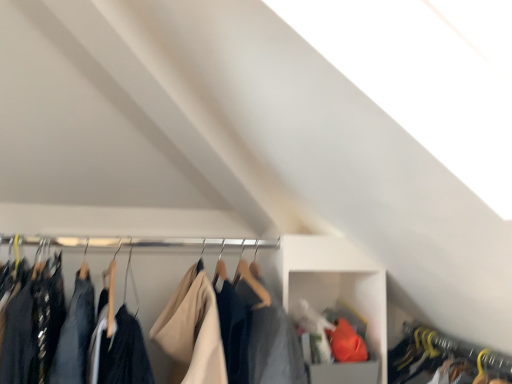
Question: Which direction should I rotate to look at dark blue fabric at center, placed as the first closet when sorted from left to right?

Choices:
 (A) right
 (B) left

Answer: (B)

Question: Can you confirm if yellow hanger at lower right, which is the 2th closet from left to right, is smaller than white plastic cabinet at center?

Choices:
 (A) yes
 (B) no

Answer: (A)

Question: Would you consider yellow hanger at lower right, which is the 2th closet from left to right, to be distant from white plastic cabinet at center?

Choices:
 (A) yes
 (B) no

Answer: (B)

Question: Is yellow hanger at lower right, which is the 2th closet from left to right, facing away from white plastic cabinet at center?

Choices:
 (A) yes
 (B) no

Answer: (B)

Question: Can you confirm if yellow hanger at lower right, which is the 2th closet from left to right, is taller than white plastic cabinet at center?

Choices:
 (A) no
 (B) yes

Answer: (A)

Question: Are yellow hanger at lower right, which is the 2th closet from left to right, and white plastic cabinet at center making contact?

Choices:
 (A) yes
 (B) no

Answer: (B)

Question: Is yellow hanger at lower right, which is the 2th closet from left to right, positioned in front of white plastic cabinet at center?

Choices:
 (A) no
 (B) yes

Answer: (B)

Question: Would you consider white plastic cabinet at center to be distant from dark blue fabric at center, the second closet when ordered from right to left?

Choices:
 (A) no
 (B) yes

Answer: (A)

Question: Can you confirm if white plastic cabinet at center is taller than dark blue fabric at center, the second closet when ordered from right to left?

Choices:
 (A) yes
 (B) no

Answer: (A)

Question: Can we say white plastic cabinet at center lies outside dark blue fabric at center, the second closet when ordered from right to left?

Choices:
 (A) no
 (B) yes

Answer: (B)

Question: Is white plastic cabinet at center at the right side of dark blue fabric at center, placed as the first closet when sorted from left to right?

Choices:
 (A) yes
 (B) no

Answer: (A)

Question: From a real-world perspective, is white plastic cabinet at center over dark blue fabric at center, the second closet when ordered from right to left?

Choices:
 (A) no
 (B) yes

Answer: (A)

Question: Considering the relative sizes of white plastic cabinet at center and dark blue fabric at center, placed as the first closet when sorted from left to right, in the image provided, is white plastic cabinet at center thinner than dark blue fabric at center, placed as the first closet when sorted from left to right,?

Choices:
 (A) no
 (B) yes

Answer: (B)

Question: Can you confirm if dark blue fabric at center, the second closet when ordered from right to left, is positioned to the left of white plastic cabinet at center?

Choices:
 (A) no
 (B) yes

Answer: (B)